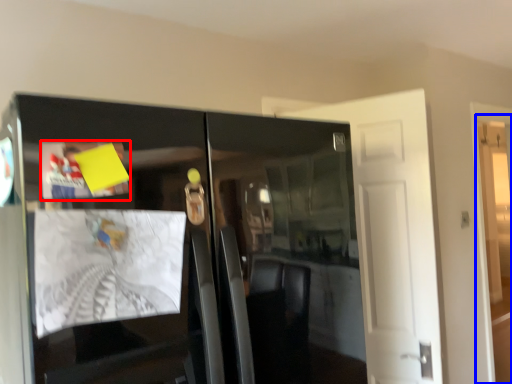
Question: Which object appears closest to the camera in this image, magazine (highlighted by a red box) or door (highlighted by a blue box)?

Choices:
 (A) magazine
 (B) door

Answer: (A)